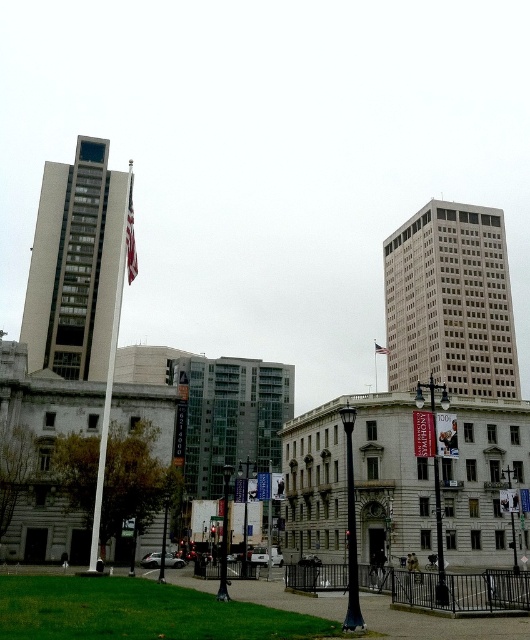
Question: Which of the following is the closest to the observer?

Choices:
 (A) american flag at center
 (B) polished silver flag pole at center
 (C) gray concrete building at center
 (D) white glass building at upper right

Answer: (B)

Question: Which of the following is the closest to the observer?

Choices:
 (A) (443, 248)
 (B) (377, 353)
 (C) (96, 516)
 (D) (90, 248)

Answer: (C)

Question: Where is gray concrete building at center located in relation to polished silver flag pole at center in the image?

Choices:
 (A) below
 (B) above

Answer: (A)

Question: Estimate the real-world distances between objects in this image. Which object is closer to the gray concrete building at center?

Choices:
 (A) polished silver flag pole at center
 (B) white fabric flag at center
 (C) american flag at center

Answer: (A)

Question: Does white glass building at upper right appear on the left side of american flag at center?

Choices:
 (A) no
 (B) yes

Answer: (A)

Question: Is white fabric flag at center smaller than american flag at center?

Choices:
 (A) no
 (B) yes

Answer: (A)